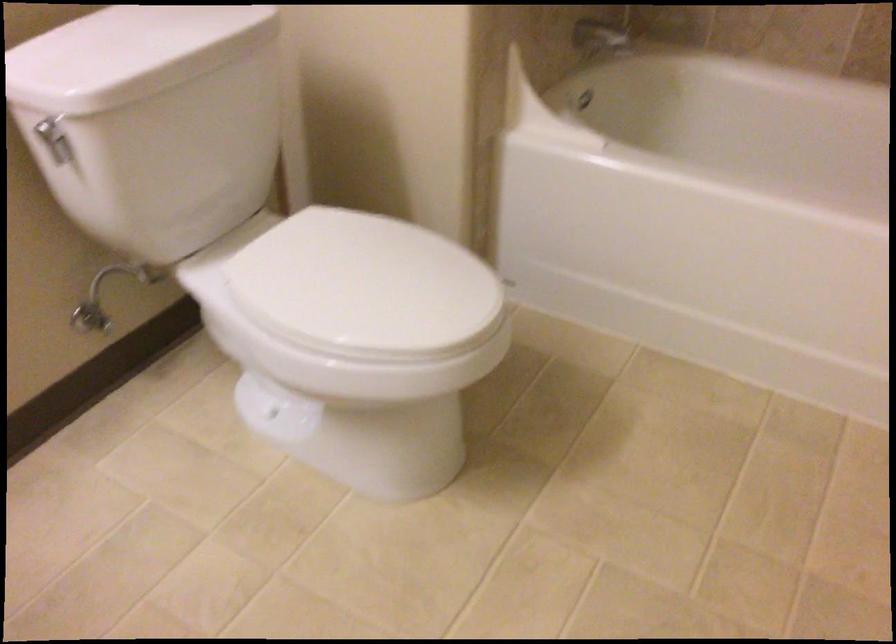
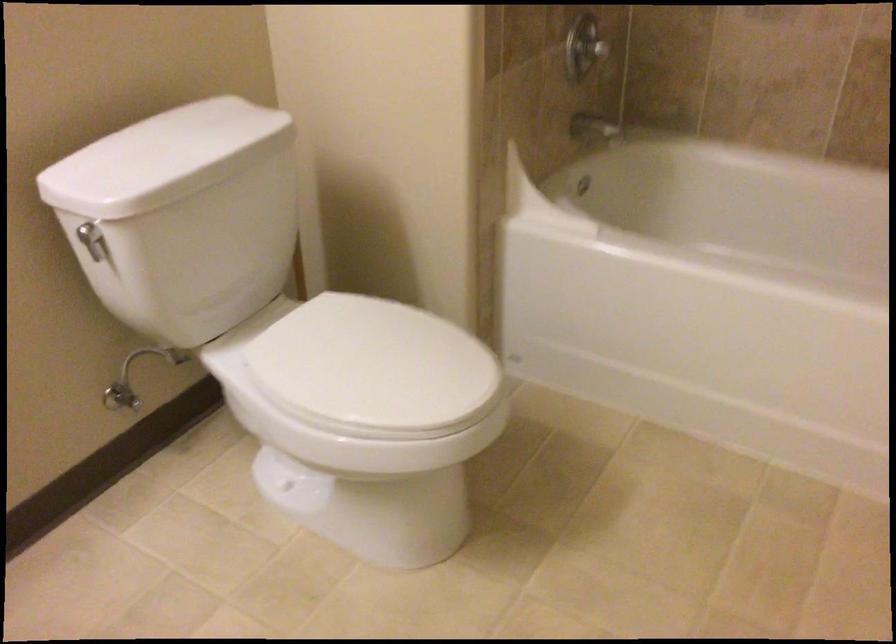
Which direction would the cameraman need to move to produce the second image?

The cameraman moved toward right, backward.